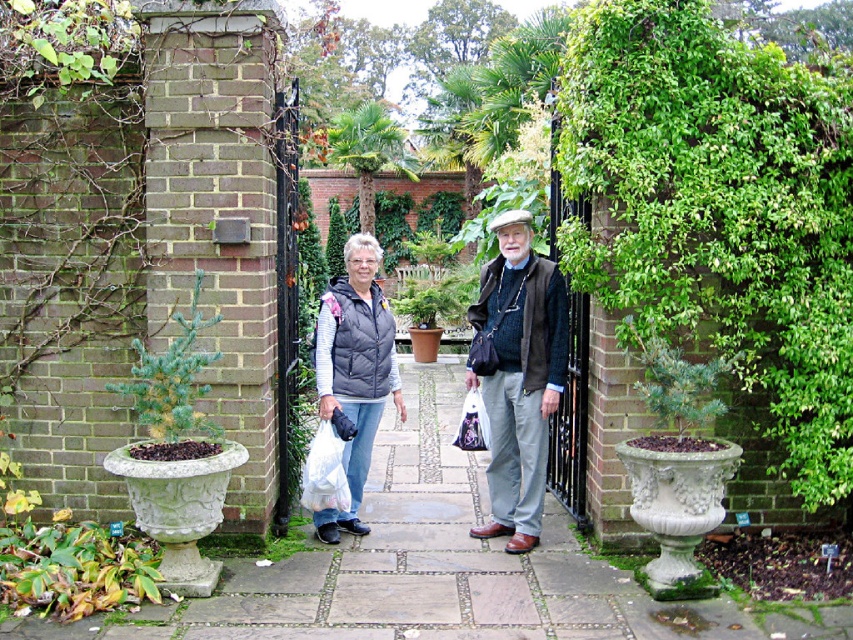
Between point (488, 490) and point (538, 305), which one is positioned behind?

The point (488, 490) is behind.

Does brown leather jacket at center have a greater height compared to matte gray vest at center?

No.

Between point (555, 276) and point (556, 404), which one is positioned in front?

Positioned in front is point (556, 404).

Where is `brown leather jacket at center`? brown leather jacket at center is located at coordinates (519, 376).

Is variegated leafy plant at lower left shorter than green needle-like plant at left?

Correct, variegated leafy plant at lower left is not as tall as green needle-like plant at left.

This screenshot has width=853, height=640. Find the location of `variegated leafy plant at lower left`. variegated leafy plant at lower left is located at coordinates (73, 570).

Who is positioned more to the right, matte gray vest at center or green needle-like plant at left?

From the viewer's perspective, matte gray vest at center appears more on the right side.

Between point (502, 452) and point (138, 362), which one is positioned behind?

The point (502, 452) is more distant.

Image resolution: width=853 pixels, height=640 pixels. In order to click on matte gray vest at center in this screenshot , I will do `click(520, 376)`.